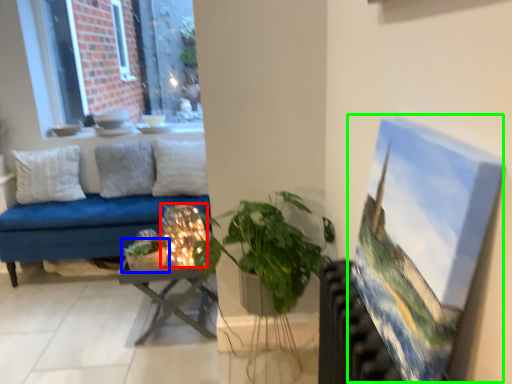
Question: Estimate the real-world distances between objects in this image. Which object is closer to candle holder (highlighted by a red box), houseplant (highlighted by a blue box) or oil painting (highlighted by a green box)?

Choices:
 (A) houseplant
 (B) oil painting

Answer: (A)